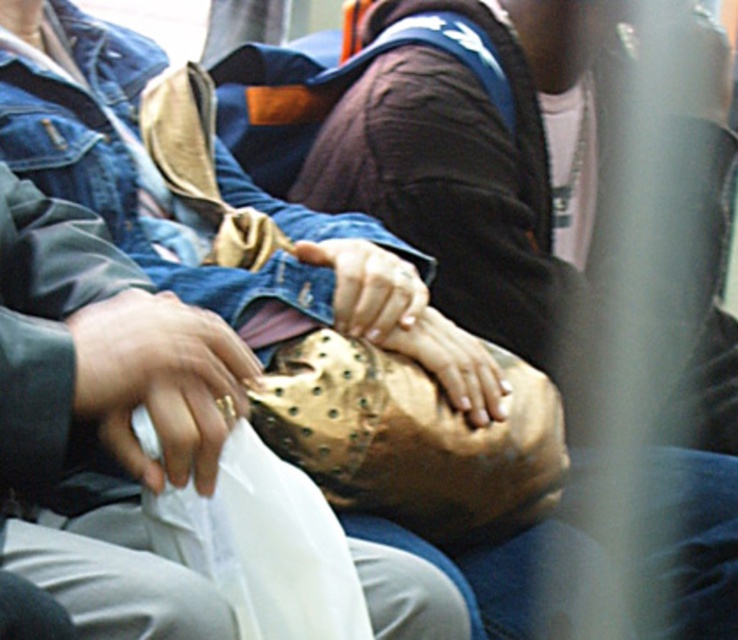
Between matte gold ring at center and matte brown leather handbag at center, which one appears on the left side from the viewer's perspective?

Positioned to the left is matte gold ring at center.

Which is in front, point (201, 403) or point (365, 321)?

Point (201, 403) is in front.

Which is behind, point (131, 442) or point (373, 250)?

The point (373, 250) is behind.

The width and height of the screenshot is (738, 640). What are the coordinates of `matte gold ring at center` in the screenshot? It's located at (159, 381).

Is gold metallic mask at center positioned before smooth leather glove at center?

No, it is behind smooth leather glove at center.

Can you confirm if gold metallic mask at center is positioned below smooth leather glove at center?

Actually, gold metallic mask at center is above smooth leather glove at center.

In order to click on gold metallic mask at center in this screenshot , I will do `click(489, 170)`.

Where is `gold metallic mask at center`? gold metallic mask at center is located at coordinates (489, 170).

At what (x,y) coordinates should I click in order to perform the action: click on matte gold ring at center. Please return your answer as a coordinate pair (x, y). This screenshot has height=640, width=738. Looking at the image, I should click on (159, 381).

Between matte gold ring at center and smooth leather glove at center, which one has more height?

Standing taller between the two is matte gold ring at center.

Who is more distant from viewer, (207, 412) or (482, 358)?

Positioned behind is point (482, 358).

At what (x,y) coordinates should I click in order to perform the action: click on matte gold ring at center. Please return your answer as a coordinate pair (x, y). This screenshot has width=738, height=640. Looking at the image, I should click on (159, 381).